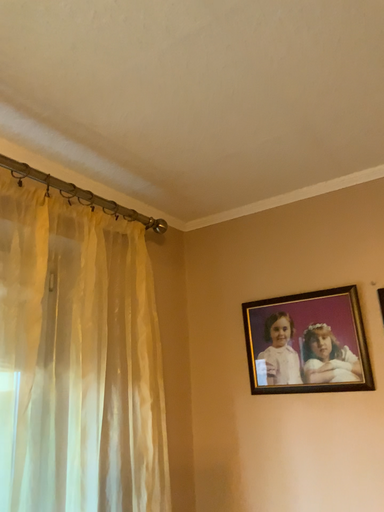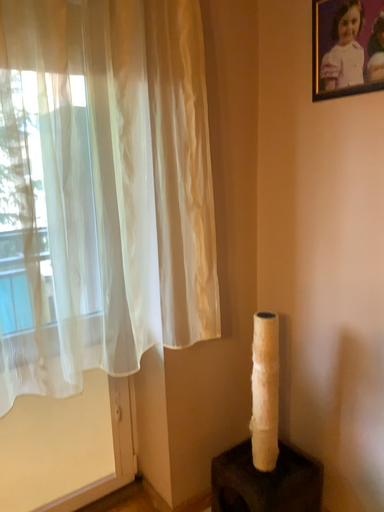
Question: Which way did the camera rotate in the video?

Choices:
 (A) rotated downward
 (B) rotated upward

Answer: (A)